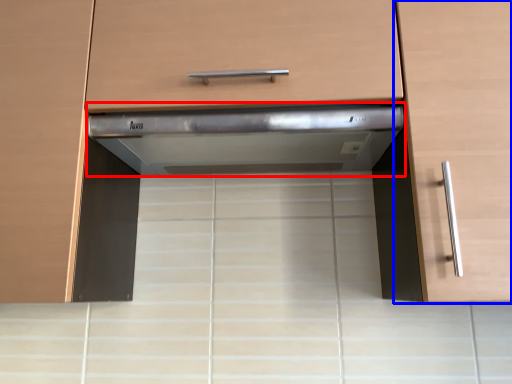
Question: Among these objects, which one is farthest to the camera, home appliance (highlighted by a red box) or cabinetry (highlighted by a blue box)?

Choices:
 (A) home appliance
 (B) cabinetry

Answer: (A)